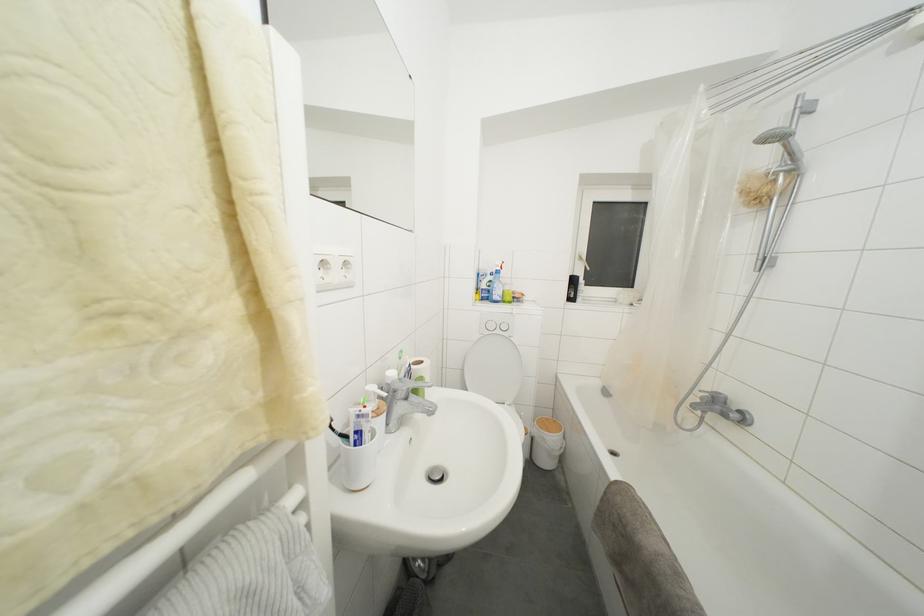
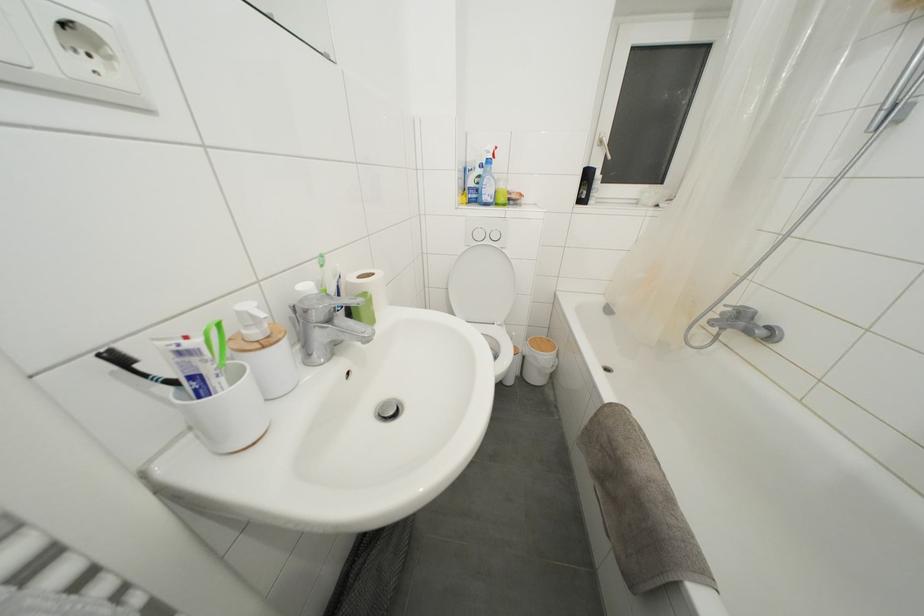
Where in the second image is the point corresponding to point (706, 403) from the first image?

(726, 318)